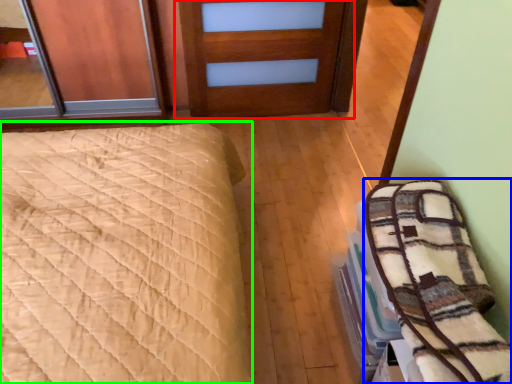
Question: Considering the real-world distances, which object is farthest from door (highlighted by a red box)? bedding (highlighted by a blue box) or bed (highlighted by a green box)?

Choices:
 (A) bedding
 (B) bed

Answer: (A)